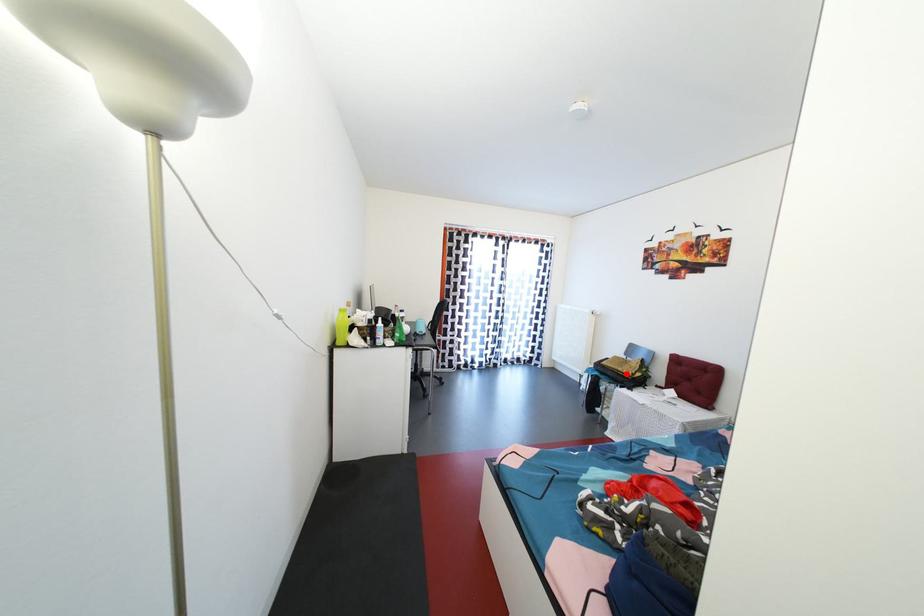
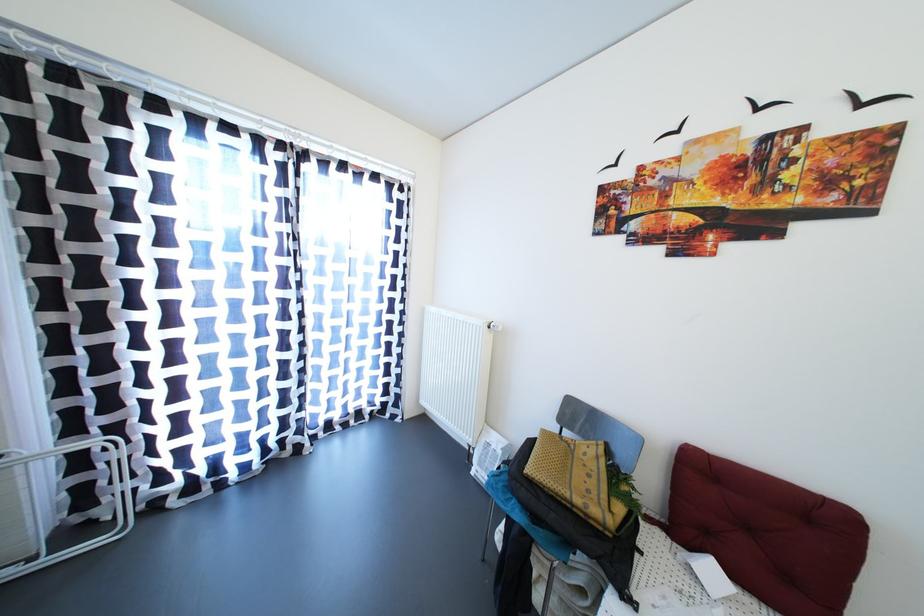
Find the pixel in the second image that matches the highlighted location in the first image.

(584, 506)